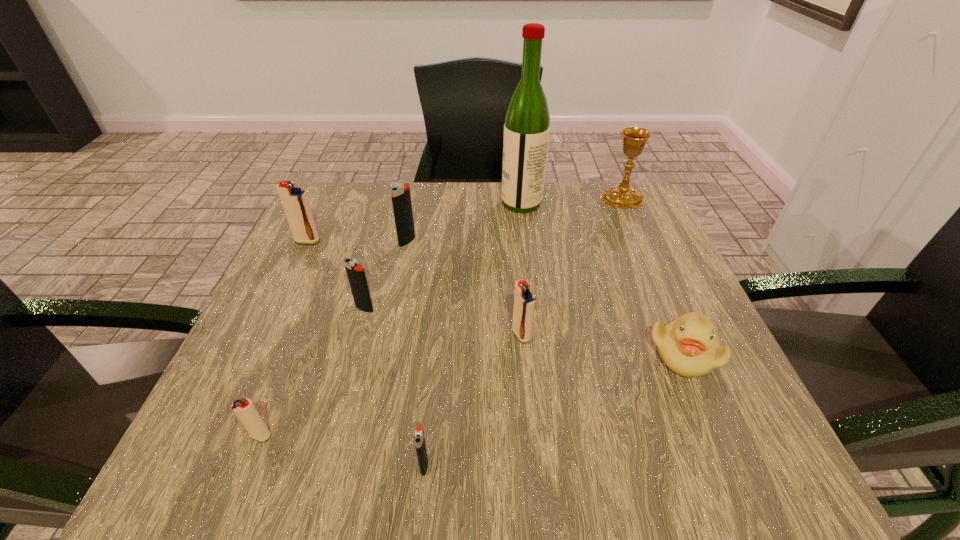
This screenshot has width=960, height=540. Identify the location of the second nearest red igniter. (524, 301).

The height and width of the screenshot is (540, 960). I want to click on yellow duckling, so click(x=687, y=345).

Locate an element on the screen. The image size is (960, 540). the fifth igniter from right to left is located at coordinates (245, 411).

Identify the location of the second nearest object. (245, 411).

Identify the location of the nearest igniter. [x=419, y=439].

Locate an element on the screen. This screenshot has height=540, width=960. the fifth igniter from left to right is located at coordinates (419, 439).

Where is `vacant region located 0.250m on the label of the liquor`? vacant region located 0.250m on the label of the liquor is located at coordinates (402, 204).

At what (x,y) coordinates should I click in order to perform the action: click on vacant space situated on the label of the liquor. Please return your answer as a coordinate pair (x, y). Image resolution: width=960 pixels, height=540 pixels. Looking at the image, I should click on (449, 204).

Where is `vacant space located on the label of the liquor`? Image resolution: width=960 pixels, height=540 pixels. vacant space located on the label of the liquor is located at coordinates (406, 204).

Identify the location of vacant position located on the left of the chalice. The width and height of the screenshot is (960, 540). (577, 197).